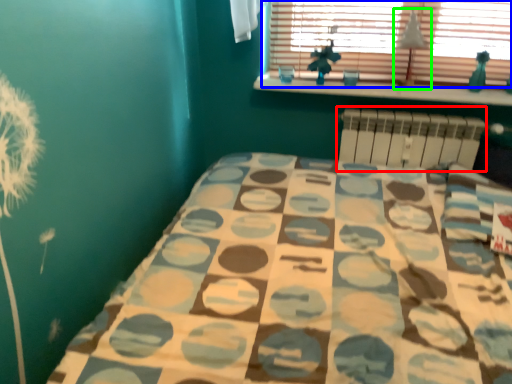
Question: Which object is the farthest from radiator (highlighted by a red box)? Choose among these: window (highlighted by a blue box) or lamp (highlighted by a green box).

Choices:
 (A) window
 (B) lamp

Answer: (A)